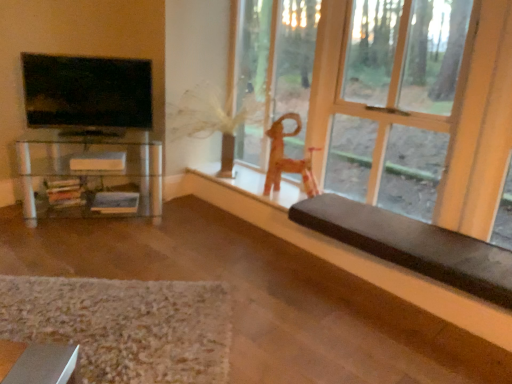
What are the coordinates of `vacant space to the right of textured beige rug at lower left` in the screenshot? It's located at (303, 310).